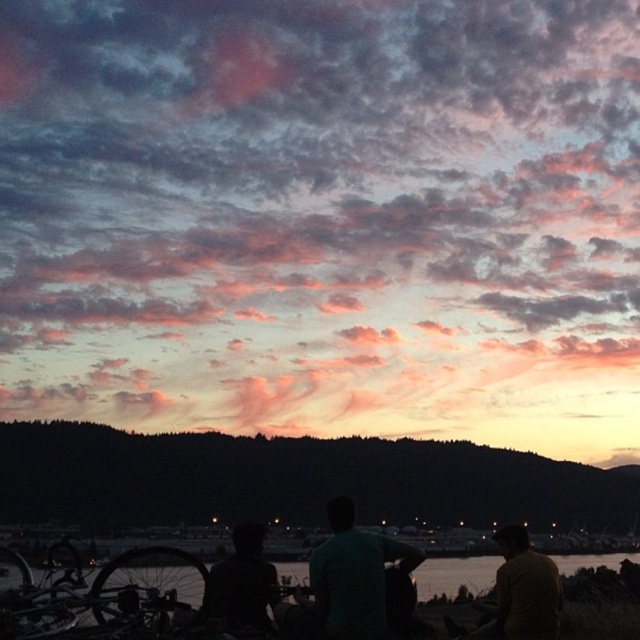
Question: Estimate the real-world distances between objects in this image. Which object is closer to the transparent water at lower center?

Choices:
 (A) silhouette figure at center
 (B) green matte shirt at center

Answer: (B)

Question: Can you confirm if silhouette figure at center is wider than transparent water at lower center?

Choices:
 (A) yes
 (B) no

Answer: (B)

Question: Which object is closer to the camera taking this photo?

Choices:
 (A) transparent water at lower center
 (B) green matte shirt at center

Answer: (B)

Question: Does green matte shirt at center have a larger size compared to silhouette figure at center?

Choices:
 (A) yes
 (B) no

Answer: (A)

Question: Is green matte shirt at center below yellow matte shirt at lower right?

Choices:
 (A) yes
 (B) no

Answer: (B)

Question: Among these points, which one is nearest to the camera?

Choices:
 (A) (424, 586)
 (B) (528, 540)
 (C) (372, 604)

Answer: (C)